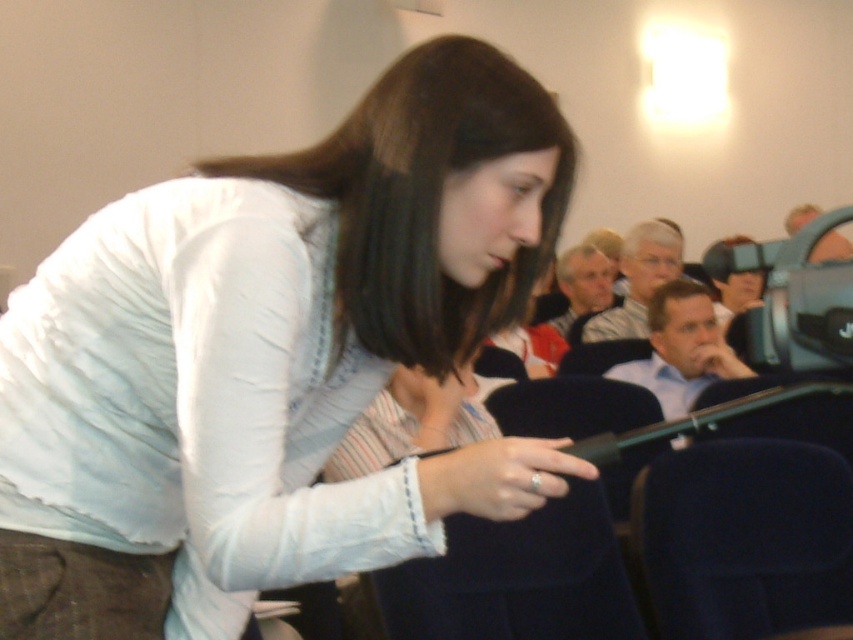
Question: Among these points, which one is farthest from the camera?

Choices:
 (A) (180, 493)
 (B) (793, 305)

Answer: (A)

Question: Is white matte shirt at center thinner than black plastic video camera at upper right?

Choices:
 (A) no
 (B) yes

Answer: (A)

Question: Is white matte shirt at center smaller than black plastic video camera at upper right?

Choices:
 (A) yes
 (B) no

Answer: (B)

Question: Is white matte shirt at center bigger than black plastic video camera at upper right?

Choices:
 (A) no
 (B) yes

Answer: (B)